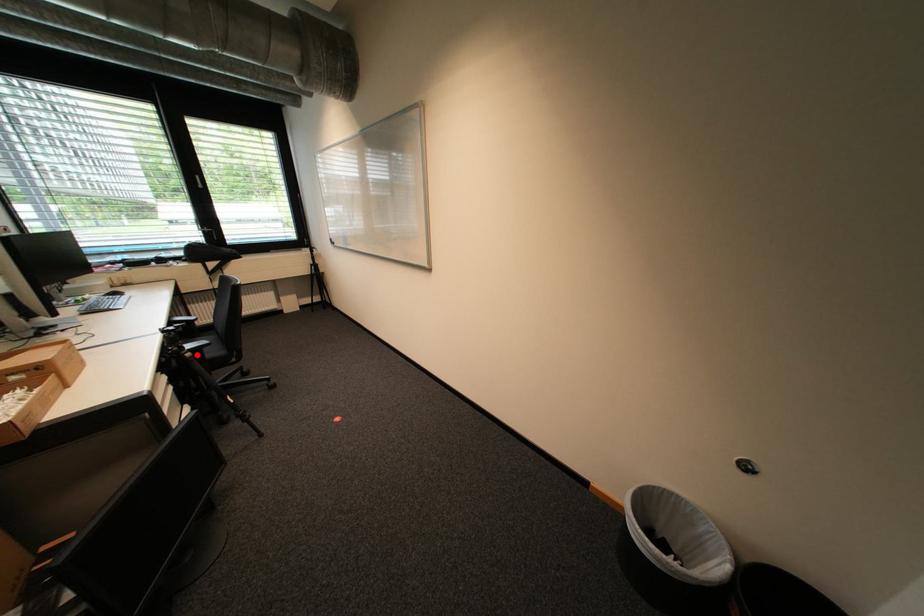
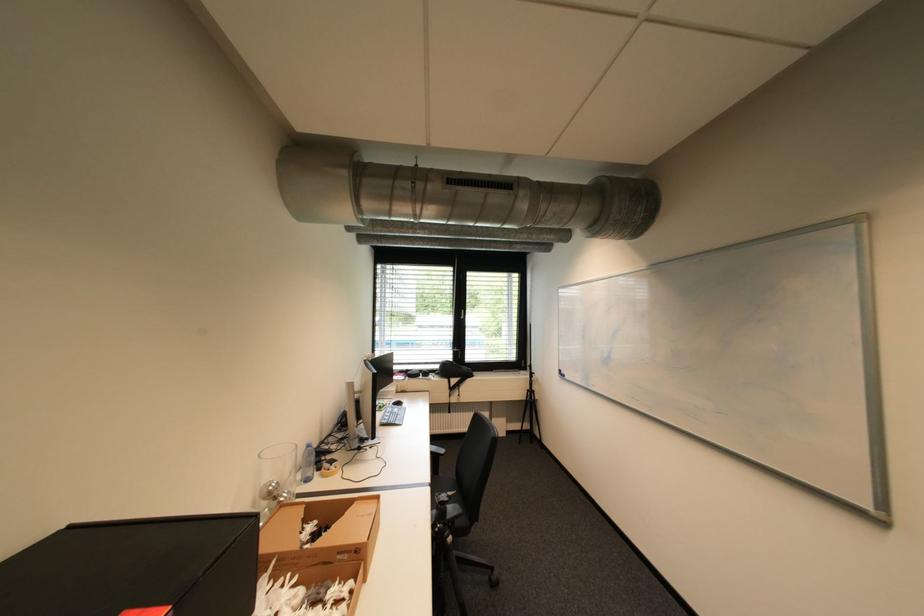
Question: I am providing you with two images of the same scene from different viewpoints. Image1 has a red point marked. In image2, the corresponding 3D location appears at what relative position? Reply with the corresponding letter.

Choices:
 (A) Closer
 (B) Farther

Answer: (B)